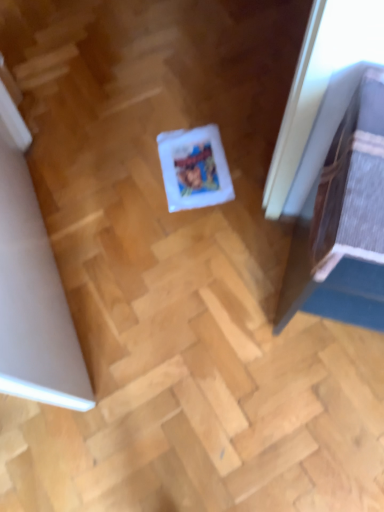
Where is `vacant space in front of wooden door at right`? vacant space in front of wooden door at right is located at coordinates (314, 408).